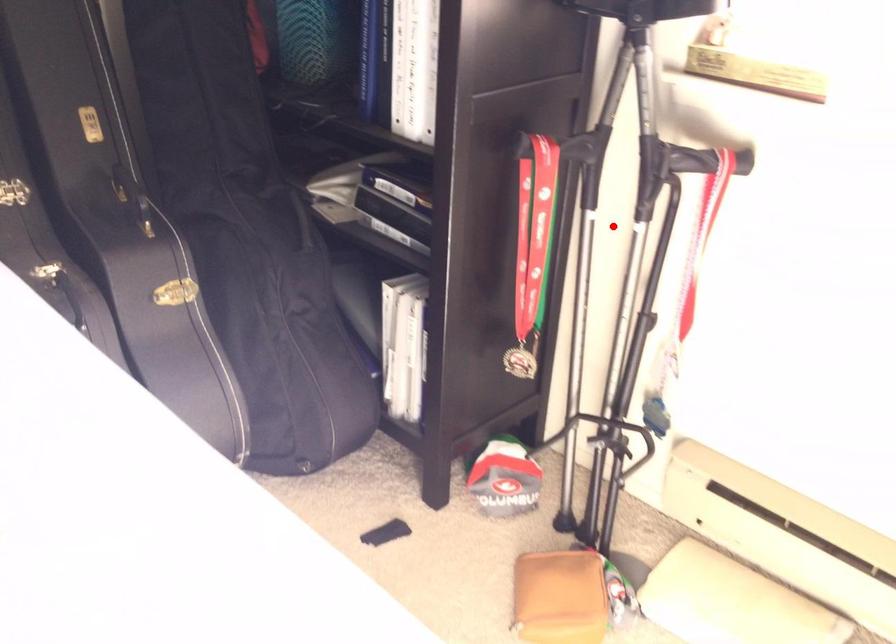
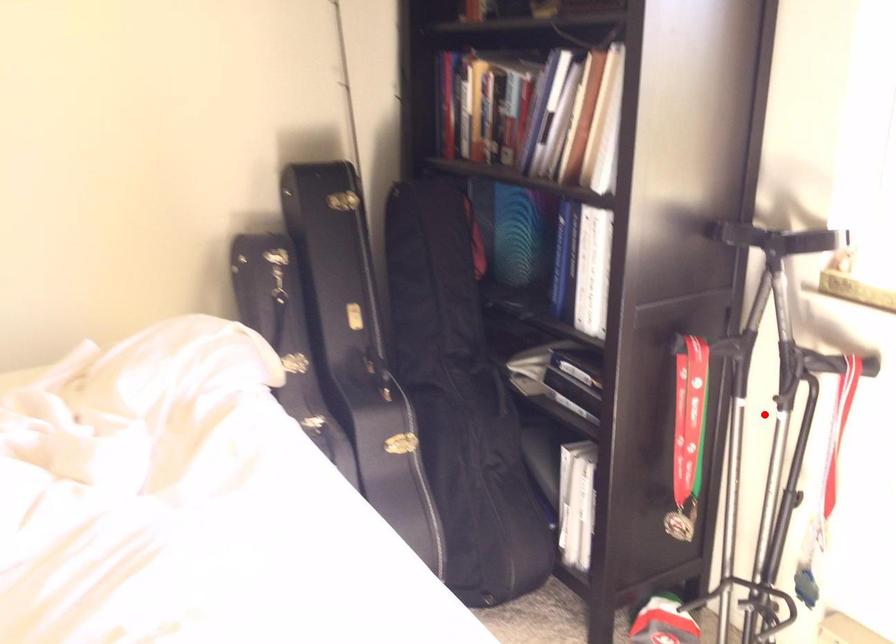
I am providing you with two images of the same scene from different viewpoints. A red point is marked on the first image and another point is marked on the second image. Do the highlighted points in image1 and image2 indicate the same real-world spot?

Yes